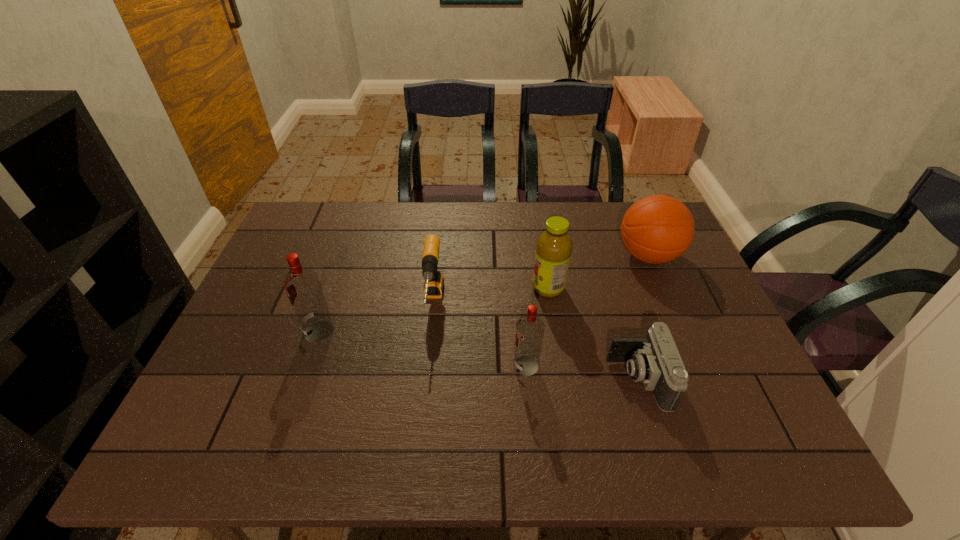
Locate an element on the screen. This screenshot has width=960, height=540. vacant space located 0.140m on the front label of the taller vodka is located at coordinates (249, 331).

This screenshot has width=960, height=540. Find the location of `vacant region located on the front label of the taller vodka`. vacant region located on the front label of the taller vodka is located at coordinates (280, 331).

Find the location of a particular element. Image resolution: width=960 pixels, height=540 pixels. vacant region located on the front label of the right vodka is located at coordinates (479, 366).

At what (x,y) coordinates should I click in order to perform the action: click on vacant space situated on the front label of the right vodka. Please return your answer as a coordinate pair (x, y). Looking at the image, I should click on [x=475, y=366].

Where is `vacant area located 0.360m on the front label of the right vodka`? vacant area located 0.360m on the front label of the right vodka is located at coordinates (361, 366).

You are a GUI agent. You are given a task and a screenshot of the screen. Output one action in this format:
    pyautogui.click(x=<x>, y=<y>)
    Task: Click on the blank space located on the front label of the fruit juice
    Image resolution: width=960 pixels, height=540 pixels.
    Given the screenshot: What is the action you would take?
    pyautogui.click(x=443, y=288)

This screenshot has height=540, width=960. Identify the location of vacant space positioned on the front label of the fruit juice. (492, 288).

Identify the location of free region located on the front label of the fruit juice. (415, 288).

At what (x,y) coordinates should I click in order to perform the action: click on free spot located on the front of the basketball. Please return your answer as a coordinate pair (x, y). This screenshot has height=540, width=960. Looking at the image, I should click on (675, 317).

Identify the location of vacant region located on the handle side of the drill. (423, 388).